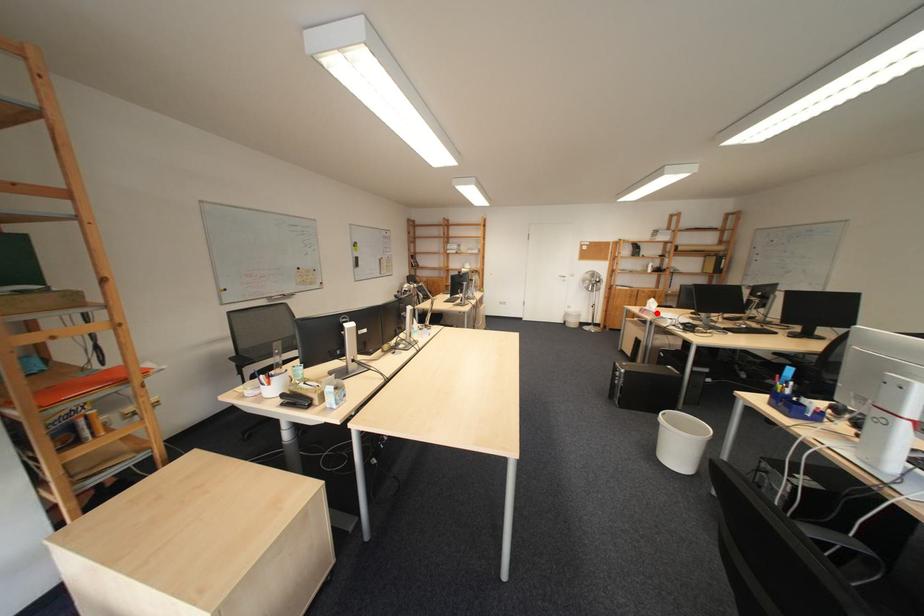
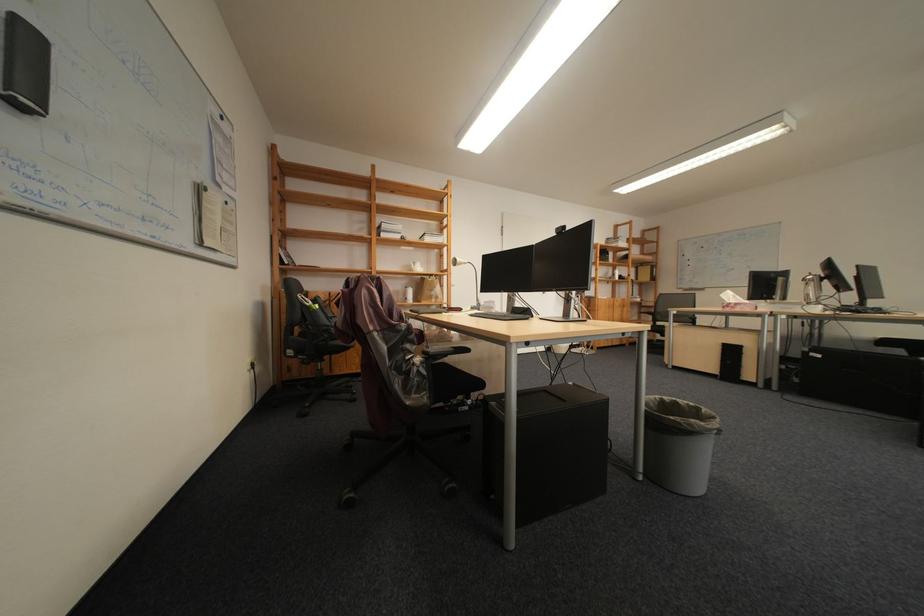
Question: I am providing you with two images of the same scene from different viewpoints. A red point is shown in image1. For the corresponding object point in image2, is it positioned nearer or farther from the camera?

Choices:
 (A) Nearer
 (B) Farther

Answer: (B)